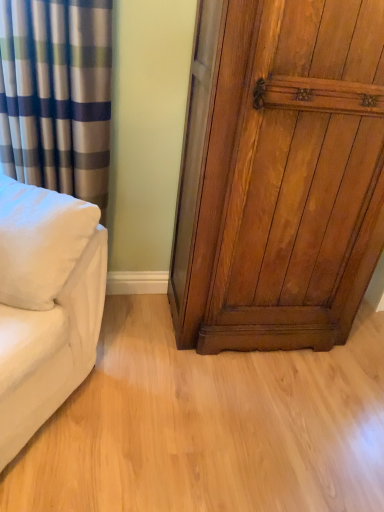
Question: Can you confirm if white soft pillow at left is bigger than shiny brown wood door at right?

Choices:
 (A) yes
 (B) no

Answer: (B)

Question: Is white soft pillow at left looking in the opposite direction of shiny brown wood door at right?

Choices:
 (A) no
 (B) yes

Answer: (A)

Question: From the image's perspective, would you say white soft pillow at left is positioned over shiny brown wood door at right?

Choices:
 (A) no
 (B) yes

Answer: (A)

Question: From a real-world perspective, does white soft pillow at left sit lower than shiny brown wood door at right?

Choices:
 (A) no
 (B) yes

Answer: (B)

Question: Considering the relative sizes of white soft pillow at left and shiny brown wood door at right in the image provided, is white soft pillow at left shorter than shiny brown wood door at right?

Choices:
 (A) no
 (B) yes

Answer: (B)

Question: Is point (66, 0) closer or farther from the camera than point (301, 163)?

Choices:
 (A) farther
 (B) closer

Answer: (B)

Question: Is silky blue-green striped curtain at left bigger or smaller than shiny brown wood door at right?

Choices:
 (A) big
 (B) small

Answer: (B)

Question: Considering the relative positions of silky blue-green striped curtain at left and shiny brown wood door at right in the image provided, is silky blue-green striped curtain at left to the left or to the right of shiny brown wood door at right?

Choices:
 (A) left
 (B) right

Answer: (A)

Question: From a real-world perspective, is silky blue-green striped curtain at left above or below shiny brown wood door at right?

Choices:
 (A) below
 (B) above

Answer: (A)

Question: Is light wood floor at center in front of or behind white soft pillow at left in the image?

Choices:
 (A) front
 (B) behind

Answer: (B)

Question: Does point (337, 367) appear closer or farther from the camera than point (3, 251)?

Choices:
 (A) closer
 (B) farther

Answer: (B)

Question: From the image's perspective, relative to white soft pillow at left, is light wood floor at center above or below?

Choices:
 (A) below
 (B) above

Answer: (A)

Question: In terms of height, does light wood floor at center look taller or shorter compared to white soft pillow at left?

Choices:
 (A) tall
 (B) short

Answer: (B)

Question: Is shiny brown wood door at right taller or shorter than white soft pillow at left?

Choices:
 (A) short
 (B) tall

Answer: (B)

Question: In the image, is shiny brown wood door at right on the left side or the right side of white soft pillow at left?

Choices:
 (A) right
 (B) left

Answer: (A)